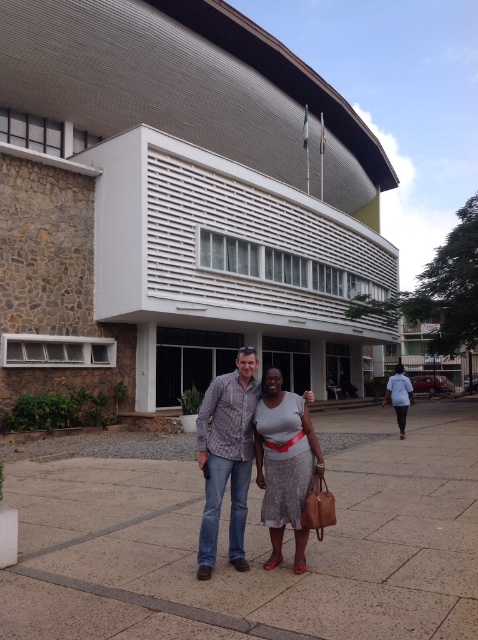
You are a photographer standing at the camera position. You want to take a closeup photo of the silver metallic dress at center. Can you walk closer to it without leaving the paved area shown in the scene?

The silver metallic dress at center is 4.07 meters away from the camera. Since you can walk closer within the paved area, you can move forward to get a better closeup shot.

You are standing at the entrance of the modern building and want to take a photo of the silver metallic dress at center. Which direction should you face to ensure the dress is in the frame?

The silver metallic dress at center is located at point (284, 465), so you should face towards the center of the image to capture it in your photo.